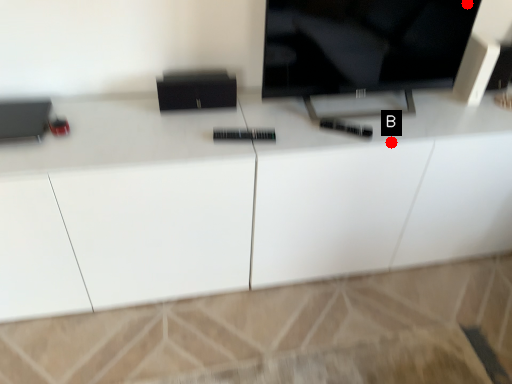
Question: Two points are circled on the image, labeled by A and B beside each circle. Which of the following is the farthest from the observer?

Choices:
 (A) A is further
 (B) B is further

Answer: (A)